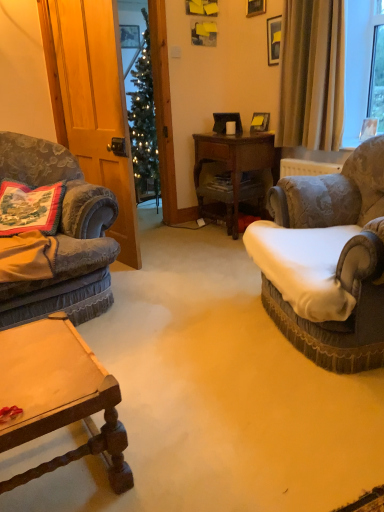
This screenshot has width=384, height=512. I want to click on vacant area to the right of matte white mug at center, so click(248, 135).